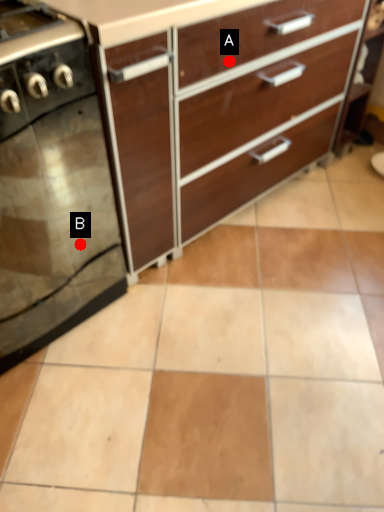
Question: Two points are circled on the image, labeled by A and B beside each circle. Which point appears closest to the camera in this image?

Choices:
 (A) A is closer
 (B) B is closer

Answer: (A)